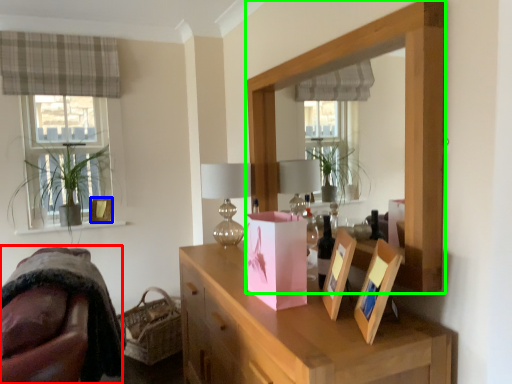
Question: Considering the real-world distances, which object is closest to swivel chair (highlighted by a red box)? picture frame (highlighted by a blue box) or mirror (highlighted by a green box).

Choices:
 (A) picture frame
 (B) mirror

Answer: (B)